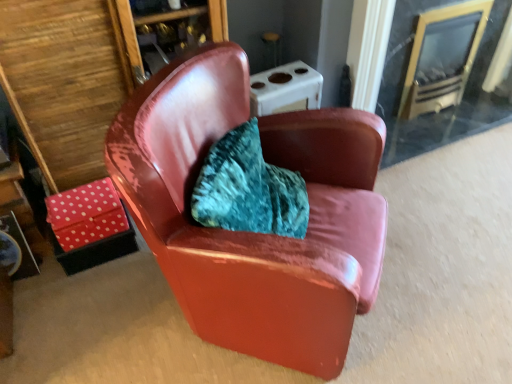
Question: From a real-world perspective, is clear glass fireplace at upper right above or below glossy leather chair at center?

Choices:
 (A) above
 (B) below

Answer: (B)

Question: In the image, is clear glass fireplace at upper right positioned in front of or behind glossy leather chair at center?

Choices:
 (A) behind
 (B) front

Answer: (A)

Question: Which object is the closest to the clear glass fireplace at upper right?

Choices:
 (A) polka dot fabric table at lower left
 (B) glossy leather chair at center

Answer: (B)

Question: Which object is the farthest from the glossy leather chair at center?

Choices:
 (A) polka dot fabric table at lower left
 (B) clear glass fireplace at upper right

Answer: (B)